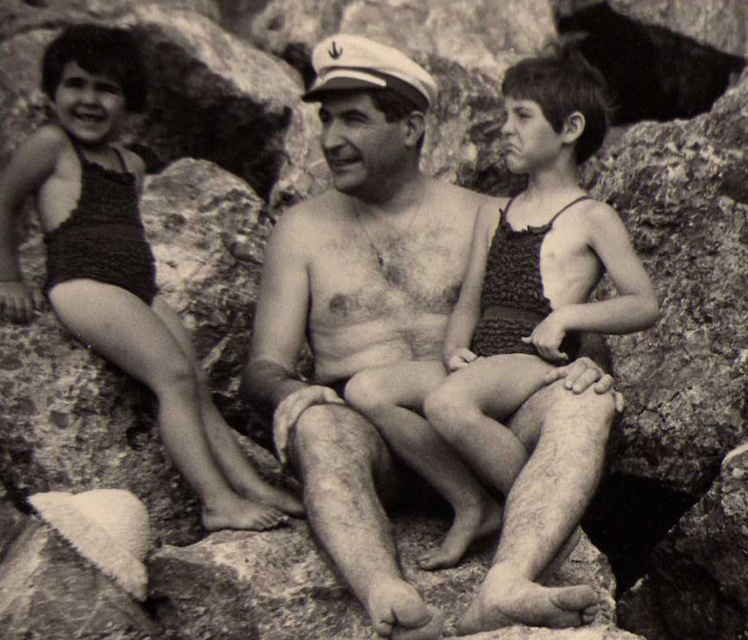
Question: Can you confirm if smooth skin man at center is wider than textured fabric swimsuit at center?

Choices:
 (A) yes
 (B) no

Answer: (B)

Question: Which is farther from the crochet fabric swimsuit at left?

Choices:
 (A) smooth skin man at center
 (B) textured fabric swimsuit at center

Answer: (B)

Question: Is smooth skin man at center further to the viewer compared to textured fabric swimsuit at center?

Choices:
 (A) yes
 (B) no

Answer: (B)

Question: Which point is closer to the camera taking this photo?

Choices:
 (A) pos(493,365)
 (B) pos(462,268)
 (C) pos(95,108)

Answer: (A)

Question: Is textured fabric swimsuit at center positioned behind crochet fabric swimsuit at left?

Choices:
 (A) no
 (B) yes

Answer: (B)

Question: Which point appears closest to the camera in this image?

Choices:
 (A) (509, 449)
 (B) (137, 304)

Answer: (A)